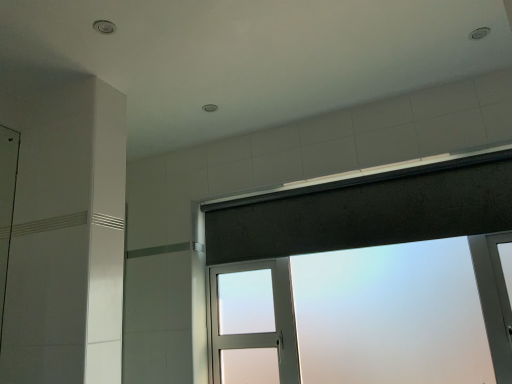
Question: Is dark gray fabric at upper center bigger or smaller than frosted glass window at upper center?

Choices:
 (A) small
 (B) big

Answer: (A)

Question: Looking at their shapes, would you say dark gray fabric at upper center is wider or thinner than frosted glass window at upper center?

Choices:
 (A) wide
 (B) thin

Answer: (B)

Question: From a real-world perspective, is dark gray fabric at upper center positioned above or below frosted glass window at upper center?

Choices:
 (A) above
 (B) below

Answer: (A)

Question: Is frosted glass window at upper center situated inside dark gray fabric at upper center or outside?

Choices:
 (A) outside
 (B) inside

Answer: (A)

Question: Is point (458, 228) closer or farther from the camera than point (386, 243)?

Choices:
 (A) closer
 (B) farther

Answer: (A)

Question: Considering the positions of frosted glass window at upper center and dark gray fabric at upper center in the image, is frosted glass window at upper center taller or shorter than dark gray fabric at upper center?

Choices:
 (A) tall
 (B) short

Answer: (A)

Question: In the image, is frosted glass window at upper center on the left side or the right side of dark gray fabric at upper center?

Choices:
 (A) right
 (B) left

Answer: (A)